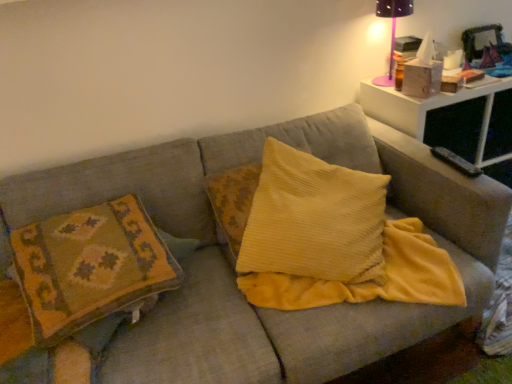
Describe the element at coordinates (391, 31) in the screenshot. I see `pink plastic table lamp at upper right` at that location.

The height and width of the screenshot is (384, 512). Describe the element at coordinates (90, 266) in the screenshot. I see `textured woolen pillow at left, which is counted as the second pillow, starting from the right` at that location.

In order to click on white plastic table at upper right in this screenshot , I will do point(429,110).

Identify the location of pink plastic table lamp at upper right. The image size is (512, 384). (391, 31).

Are textured woolen pillow at left, which is counted as the second pillow, starting from the right, and white plastic table at upper right located far from each other?

textured woolen pillow at left, which is counted as the second pillow, starting from the right, is far away from white plastic table at upper right.

From a real-world perspective, is textured woolen pillow at left, the 1th pillow when ordered from left to right, physically above white plastic table at upper right?

Correct, in the physical world, textured woolen pillow at left, the 1th pillow when ordered from left to right, is higher than white plastic table at upper right.

Is textured woolen pillow at left, which is counted as the second pillow, starting from the right, to the right of white plastic table at upper right from the viewer's perspective?

Incorrect, textured woolen pillow at left, which is counted as the second pillow, starting from the right, is not on the right side of white plastic table at upper right.

Which of these two, textured woolen pillow at left, the 1th pillow when ordered from left to right, or white plastic table at upper right, is bigger?

With larger size is white plastic table at upper right.

Is pink plastic table lamp at upper right smaller than white plastic table at upper right?

Yes.

Consider the image. Can you confirm if pink plastic table lamp at upper right is wider than white plastic table at upper right?

No.

Considering the sizes of objects pink plastic table lamp at upper right and white plastic table at upper right in the image provided, who is shorter, pink plastic table lamp at upper right or white plastic table at upper right?

With less height is pink plastic table lamp at upper right.

Visually, is textured fabric couch at center positioned to the left or to the right of pink plastic table lamp at upper right?

textured fabric couch at center is to the left of pink plastic table lamp at upper right.

Is pink plastic table lamp at upper right at the back of textured fabric couch at center?

No, textured fabric couch at center's orientation is not away from pink plastic table lamp at upper right.

At what (x,y) coordinates should I click in order to perform the action: click on couch that is below the pink plastic table lamp at upper right (from the image's perspective). Please return your answer as a coordinate pair (x, y). This screenshot has width=512, height=384. Looking at the image, I should click on (233, 265).

Is textured fabric couch at center far away from pink plastic table lamp at upper right?

textured fabric couch at center is actually quite close to pink plastic table lamp at upper right.

Is white plastic table at upper right inside the boundaries of textured woolen pillow at left, the 1th pillow when ordered from left to right, or outside?

white plastic table at upper right is not inside textured woolen pillow at left, the 1th pillow when ordered from left to right, it's outside.

From the image's perspective, is white plastic table at upper right on top of textured woolen pillow at left, the 1th pillow when ordered from left to right?

Yes, from the image's perspective, white plastic table at upper right is over textured woolen pillow at left, the 1th pillow when ordered from left to right.

How far apart are white plastic table at upper right and textured woolen pillow at left, which is counted as the second pillow, starting from the right?

They are 4.10 feet apart.

Would you say white plastic table at upper right is a long distance from textured woolen pillow at left, the 1th pillow when ordered from left to right?

That's right, there is a large distance between white plastic table at upper right and textured woolen pillow at left, the 1th pillow when ordered from left to right.

Is textured woolen pillow at left, the 1th pillow when ordered from left to right, turned away from yellow corduroy pillow at center, positioned as the first pillow in right-to-left order?

No, yellow corduroy pillow at center, positioned as the first pillow in right-to-left order, is not at the back of textured woolen pillow at left, the 1th pillow when ordered from left to right.

From a real-world perspective, who is located lower, textured woolen pillow at left, the 1th pillow when ordered from left to right, or yellow corduroy pillow at center, the second pillow from the left?

textured woolen pillow at left, the 1th pillow when ordered from left to right, from a real-world perspective.

Looking at this image, how different are the orientations of textured woolen pillow at left, the 1th pillow when ordered from left to right, and yellow corduroy pillow at center, the second pillow from the left, in degrees?

33.6 degrees.

From their relative heights in the image, would you say textured woolen pillow at left, which is counted as the second pillow, starting from the right, is taller or shorter than yellow corduroy pillow at center, positioned as the first pillow in right-to-left order?

In the image, textured woolen pillow at left, which is counted as the second pillow, starting from the right, appears to be taller than yellow corduroy pillow at center, positioned as the first pillow in right-to-left order.

From the image's perspective, which is above, white plastic table at upper right or yellow corduroy pillow at center, positioned as the first pillow in right-to-left order?

white plastic table at upper right, from the image's perspective.

Which is behind, point (492, 158) or point (308, 230)?

The point (492, 158) is farther.

Considering the relative sizes of white plastic table at upper right and pink plastic table lamp at upper right in the image provided, is white plastic table at upper right shorter than pink plastic table lamp at upper right?

No.

Based on the photo, considering the relative sizes of white plastic table at upper right and pink plastic table lamp at upper right in the image provided, is white plastic table at upper right wider than pink plastic table lamp at upper right?

Correct, the width of white plastic table at upper right exceeds that of pink plastic table lamp at upper right.

Consider the image. Would you say white plastic table at upper right is outside pink plastic table lamp at upper right?

white plastic table at upper right lies outside pink plastic table lamp at upper right's area.

Does point (505, 156) lie in front of point (382, 13)?

That is False.

Identify the location of the 2nd pillow in front of the white plastic table at upper right, starting your count from the anchor. The width and height of the screenshot is (512, 384). (90, 266).

The width and height of the screenshot is (512, 384). In order to click on table lamp behind the white plastic table at upper right in this screenshot , I will do `click(391, 31)`.

From the image, which object appears to be nearer to pink plastic table lamp at upper right, textured woolen pillow at left, the 1th pillow when ordered from left to right, or textured fabric couch at center?

textured fabric couch at center.

Looking at this image, considering their positions, is yellow corduroy pillow at center, the second pillow from the left, positioned closer to white plastic table at upper right than textured fabric couch at center?

yellow corduroy pillow at center, the second pillow from the left, lies closer to white plastic table at upper right than the other object.

Based on their spatial positions, is yellow corduroy pillow at center, positioned as the first pillow in right-to-left order, or textured fabric couch at center closer to textured woolen pillow at left, the 1th pillow when ordered from left to right?

Based on the image, textured fabric couch at center appears to be nearer to textured woolen pillow at left, the 1th pillow when ordered from left to right.

Considering their positions, is textured woolen pillow at left, which is counted as the second pillow, starting from the right, positioned further to yellow corduroy pillow at center, the second pillow from the left, than white plastic table at upper right?

white plastic table at upper right.

From the image, which object appears to be farther from yellow corduroy pillow at center, the second pillow from the left, textured fabric couch at center or pink plastic table lamp at upper right?

Based on the image, pink plastic table lamp at upper right appears to be further to yellow corduroy pillow at center, the second pillow from the left.

From the picture: From the image, which object appears to be nearer to pink plastic table lamp at upper right, yellow corduroy pillow at center, the second pillow from the left, or textured woolen pillow at left, which is counted as the second pillow, starting from the right?

The object closer to pink plastic table lamp at upper right is yellow corduroy pillow at center, the second pillow from the left.

Based on their spatial positions, is yellow corduroy pillow at center, positioned as the first pillow in right-to-left order, or white plastic table at upper right further from textured fabric couch at center?

white plastic table at upper right is positioned further to the anchor textured fabric couch at center.

Looking at the image, which one is located further to yellow corduroy pillow at center, the second pillow from the left, textured woolen pillow at left, which is counted as the second pillow, starting from the right, or textured fabric couch at center?

The object further to yellow corduroy pillow at center, the second pillow from the left, is textured woolen pillow at left, which is counted as the second pillow, starting from the right.

Locate an element on the screen. pillow between textured woolen pillow at left, which is counted as the second pillow, starting from the right, and white plastic table at upper right from left to right is located at coordinates (314, 219).

Where is `pillow between textured woolen pillow at left, the 1th pillow when ordered from left to right, and pink plastic table lamp at upper right`? pillow between textured woolen pillow at left, the 1th pillow when ordered from left to right, and pink plastic table lamp at upper right is located at coordinates (314, 219).

At what (x,y) coordinates should I click in order to perform the action: click on table lamp located between textured woolen pillow at left, the 1th pillow when ordered from left to right, and white plastic table at upper right in the left-right direction. Please return your answer as a coordinate pair (x, y). Looking at the image, I should click on (391, 31).

The image size is (512, 384). I want to click on couch located between textured woolen pillow at left, the 1th pillow when ordered from left to right, and pink plastic table lamp at upper right in the left-right direction, so click(x=233, y=265).